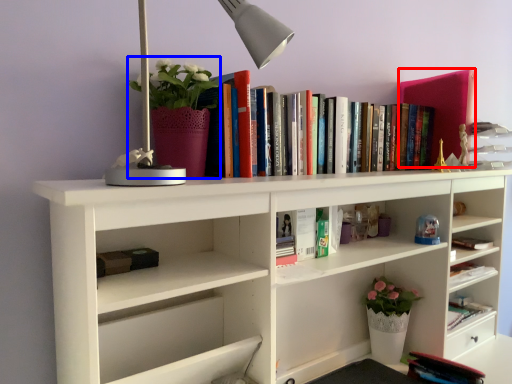
Question: Which object is further to the camera taking this photo, paperback book (highlighted by a red box) or floral arrangement (highlighted by a blue box)?

Choices:
 (A) paperback book
 (B) floral arrangement

Answer: (A)